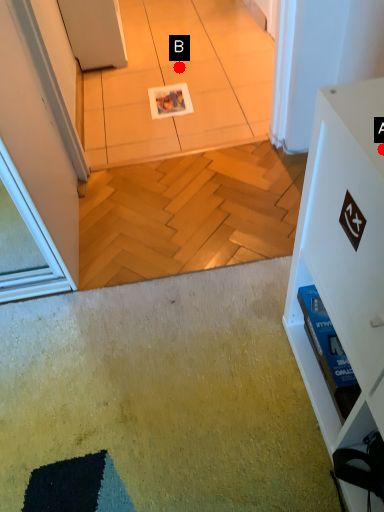
Question: Two points are circled on the image, labeled by A and B beside each circle. Which point is further to the camera?

Choices:
 (A) A is further
 (B) B is further

Answer: (B)